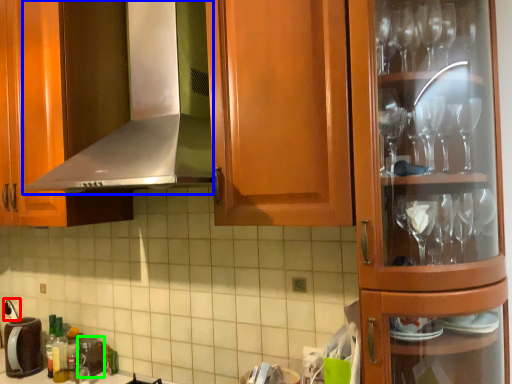
Question: Which is nearer to the faucet (highlighted by a red box)? exhaust hood (highlighted by a blue box) or appliance (highlighted by a green box).

Choices:
 (A) exhaust hood
 (B) appliance

Answer: (B)